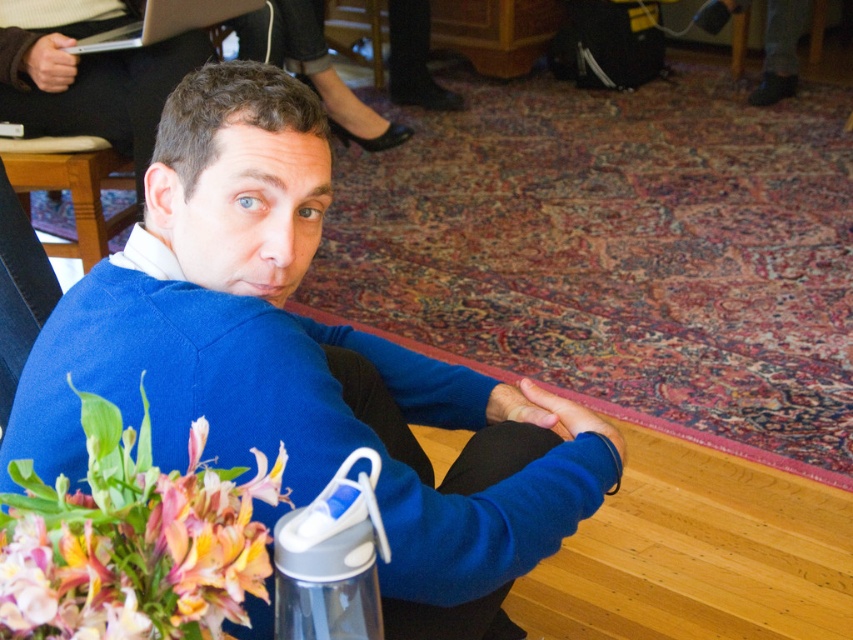
You are organizing a meeting in this room and need to place a 1.5 foot wide presentation screen between the silver metallic laptop at upper left and the matte black armchair at upper center. Can the screen fit without overlapping either object?

The silver metallic laptop at upper left is to the left of the matte black armchair at upper center, so the space between them is sufficient to place the 1.5 foot wide presentation screen without overlapping either object.

You are standing in the room and want to place a new decorative item exactly where the floral bouquet at lower left is currently located. What are the coordinates of the spot where you should place it?

The coordinates for the floral bouquet at lower left are at point (132, 540), so you should place the new decorative item there.